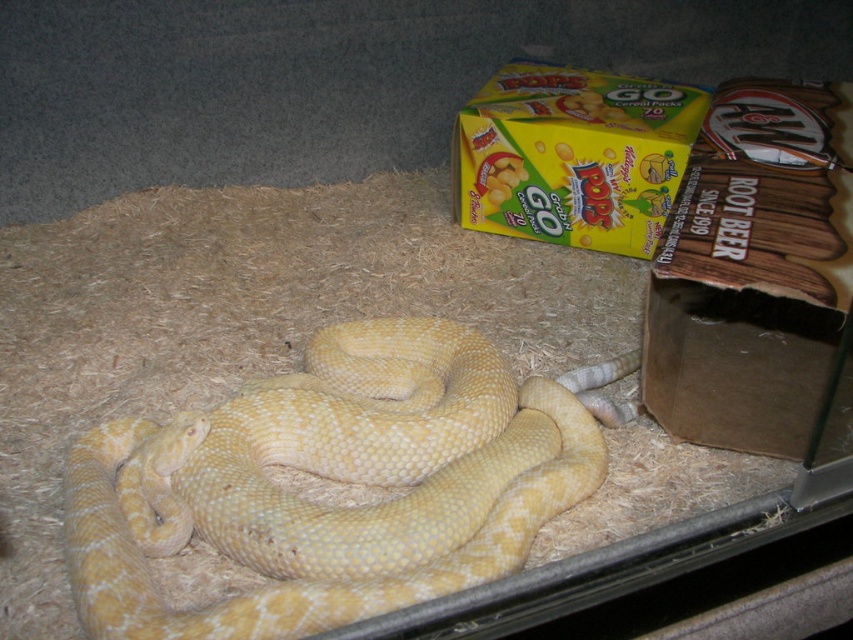
Find the location of a particular element. yellow scaly snake at center is located at coordinates (334, 480).

Does yellow scaly snake at center appear over yellow cardboard box at upper right?

No, yellow scaly snake at center is not above yellow cardboard box at upper right.

Is point (244, 522) positioned before point (552, 106)?

Yes, point (244, 522) is in front of point (552, 106).

Where is `yellow scaly snake at center`? The height and width of the screenshot is (640, 853). yellow scaly snake at center is located at coordinates (334, 480).